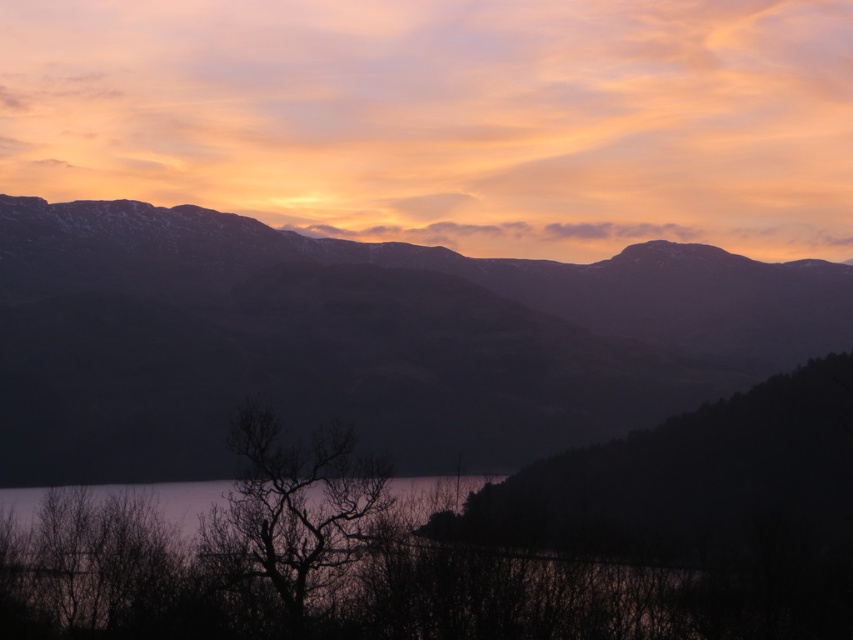
Question: Does dark purple mountain range at center appear over silhouette bare tree at center?

Choices:
 (A) no
 (B) yes

Answer: (B)

Question: Which point is farther from the camera taking this photo?

Choices:
 (A) (134, 266)
 (B) (340, 515)

Answer: (A)

Question: Is dark purple mountain range at center further to camera compared to silhouette bare tree at center?

Choices:
 (A) yes
 (B) no

Answer: (A)

Question: Which point is closer to the camera taking this photo?

Choices:
 (A) (479, 278)
 (B) (283, 508)

Answer: (B)

Question: Is dark purple mountain range at center positioned at the back of silhouette bare tree at center?

Choices:
 (A) yes
 (B) no

Answer: (A)